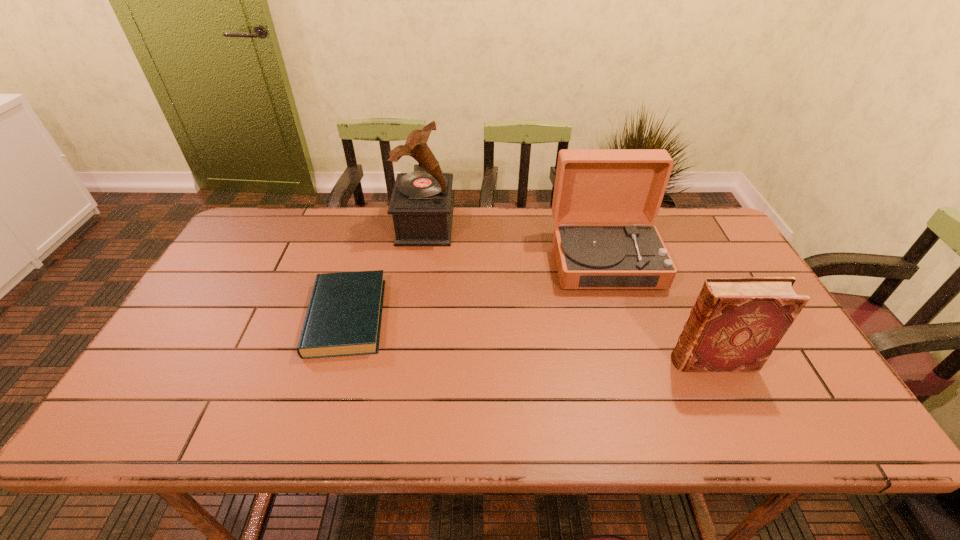
Locate an element on the screen. This screenshot has height=540, width=960. free space between the taller phonograph record and the second shortest object is located at coordinates (569, 293).

At what (x,y) coordinates should I click in order to perform the action: click on free area in between the right phonograph record and the shortest object. Please return your answer as a coordinate pair (x, y). This screenshot has height=540, width=960. Looking at the image, I should click on (476, 288).

Find the location of a particular element. This screenshot has width=960, height=540. vacant space that's between the left phonograph record and the shorter book is located at coordinates click(386, 271).

Where is `free point between the shorter book and the right phonograph record`? The width and height of the screenshot is (960, 540). free point between the shorter book and the right phonograph record is located at coordinates (476, 288).

You are a GUI agent. You are given a task and a screenshot of the screen. Output one action in this format:
    pyautogui.click(x=<x>, y=<y>)
    Task: Click on the free space between the right book and the shorter phonograph record
    The image size is (960, 540).
    Given the screenshot: What is the action you would take?
    pyautogui.click(x=659, y=310)

Find the location of a particular element. The width and height of the screenshot is (960, 540). free space between the taller phonograph record and the shortest object is located at coordinates (386, 271).

Find the location of a particular element. The image size is (960, 540). empty space between the taller phonograph record and the shorter phonograph record is located at coordinates (516, 243).

You are a GUI agent. You are given a task and a screenshot of the screen. Output one action in this format:
    pyautogui.click(x=<x>, y=<y>)
    Task: Click on the empty space between the tallest object and the third tallest object
    This screenshot has height=540, width=960.
    Given the screenshot: What is the action you would take?
    pyautogui.click(x=569, y=293)

Locate an element on the screen. This screenshot has width=960, height=540. free space between the right phonograph record and the shortest object is located at coordinates (476, 288).

Identify which object is located as the third nearest to the shortest object. Please provide its 2D coordinates. Your answer should be formatted as a tuple, i.e. [(x, y)], where the tuple contains the x and y coordinates of a point satisfying the conditions above.

[(736, 323)]